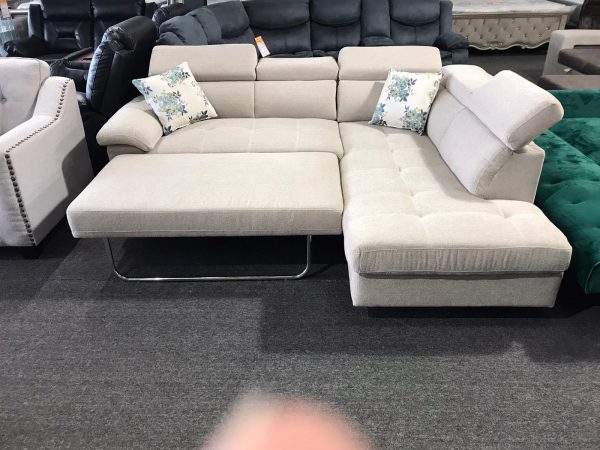
Locate an element on the screen. part of a furniture store is located at coordinates (435, 44), (84, 370), (74, 320), (21, 378), (66, 126), (112, 55).